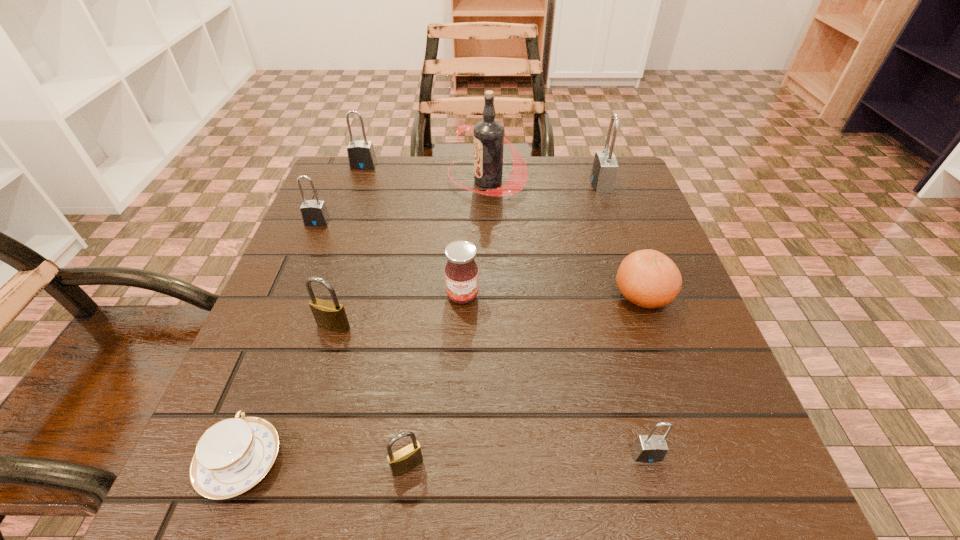
Where is `object that is positioned at the near right corner`? This screenshot has height=540, width=960. object that is positioned at the near right corner is located at coordinates (650, 448).

This screenshot has width=960, height=540. Find the location of `vacant space at the far edge of the desktop`. vacant space at the far edge of the desktop is located at coordinates (532, 161).

In the image, there is a desktop. Where is `vacant space at the near edge`? This screenshot has width=960, height=540. vacant space at the near edge is located at coordinates (544, 458).

Image resolution: width=960 pixels, height=540 pixels. In the image, there is a desktop. Find the location of `free space at the left edge`. free space at the left edge is located at coordinates (295, 265).

Where is `vacant position at the right edge of the desktop`? Image resolution: width=960 pixels, height=540 pixels. vacant position at the right edge of the desktop is located at coordinates (608, 252).

This screenshot has width=960, height=540. I want to click on free space at the far left corner of the desktop, so click(x=344, y=197).

Locate an element on the screen. The width and height of the screenshot is (960, 540). vacant space at the far right corner of the desktop is located at coordinates (x=585, y=179).

At what (x,y) coordinates should I click in order to perform the action: click on free space between the right brass padlock and the shortest object. Please return your answer as a coordinate pair (x, y). The height and width of the screenshot is (540, 960). Looking at the image, I should click on (324, 463).

Where is `free point between the second nearest gray padlock and the jam`? This screenshot has height=540, width=960. free point between the second nearest gray padlock and the jam is located at coordinates (390, 259).

Find the location of a particular element. This screenshot has height=540, width=960. vacant area that lies between the third farthest gray padlock and the smaller brass padlock is located at coordinates (363, 344).